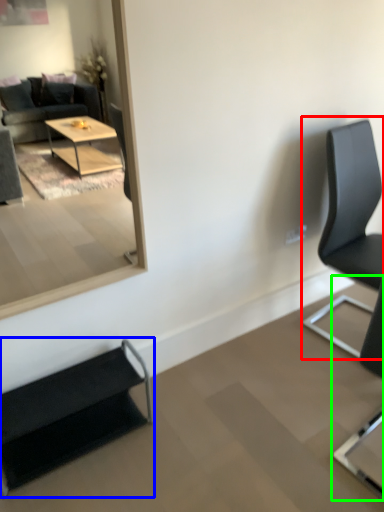
Question: Which object is positioned closest to chair (highlighted by a red box)? Select from chair (highlighted by a blue box) and chair (highlighted by a green box).

Choices:
 (A) chair
 (B) chair

Answer: (B)